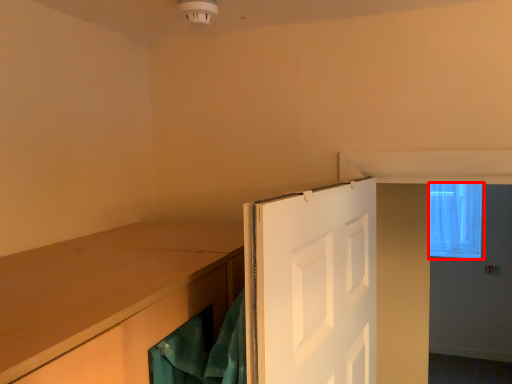
Question: From the image, what is the correct spatial relationship of window (annotated by the red box) in relation to door?

Choices:
 (A) right
 (B) left

Answer: (A)